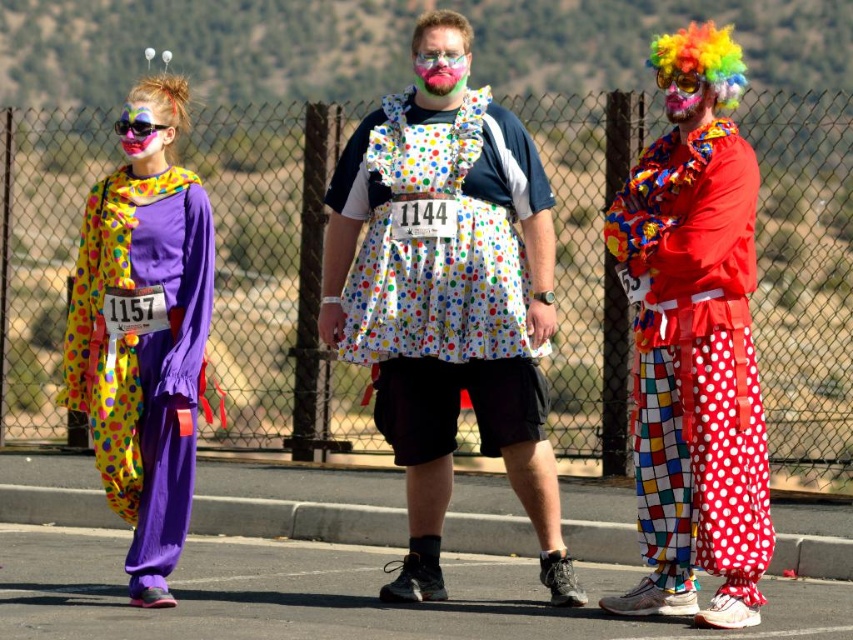
Question: Which of the following is the closest to the observer?

Choices:
 (A) polka dot fabric clown pants at right
 (B) metal mesh fence at center

Answer: (A)

Question: Among these objects, which one is nearest to the camera?

Choices:
 (A) matte black sunglasses at upper left
 (B) rainbow wig at center

Answer: (B)

Question: Which object is positioned closest to the matte clown face at left?

Choices:
 (A) purple polka dot clown suit at left
 (B) white polka dot dress at center
 (C) rainbow wig at center

Answer: (A)

Question: From the image, what is the correct spatial relationship of purple polka dot clown suit at left in relation to matte black sunglasses at upper left?

Choices:
 (A) left
 (B) right

Answer: (B)

Question: Can you confirm if purple polka dot clown suit at left is wider than pink matte goggles at center?

Choices:
 (A) yes
 (B) no

Answer: (A)

Question: Does rainbow wig at center appear over matte clown face at left?

Choices:
 (A) yes
 (B) no

Answer: (A)